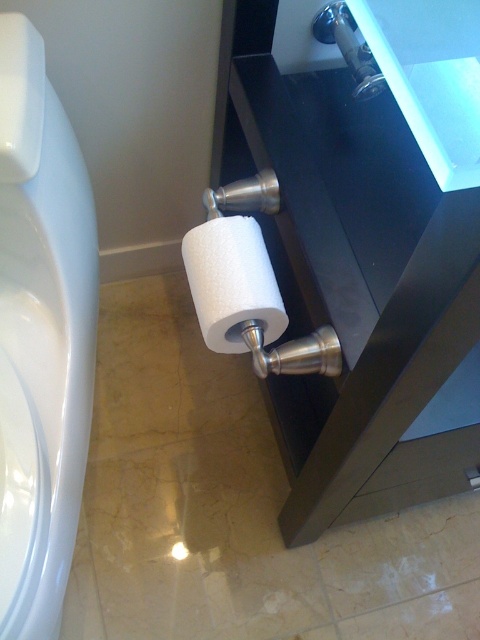
Question: Does white glossy toilet bowl at lower left come behind white matte toilet paper at lower center?

Choices:
 (A) no
 (B) yes

Answer: (A)

Question: Is white glossy toilet bowl at lower left wider than white matte toilet paper at lower center?

Choices:
 (A) no
 (B) yes

Answer: (B)

Question: Which of the following is the farthest from the observer?

Choices:
 (A) (32, 598)
 (B) (239, 323)

Answer: (B)

Question: Which of the following is the farthest from the observer?

Choices:
 (A) (211, 285)
 (B) (8, 396)

Answer: (B)

Question: In this image, where is white glossy toilet bowl at lower left located relative to white matte toilet paper at lower center?

Choices:
 (A) above
 (B) below

Answer: (B)